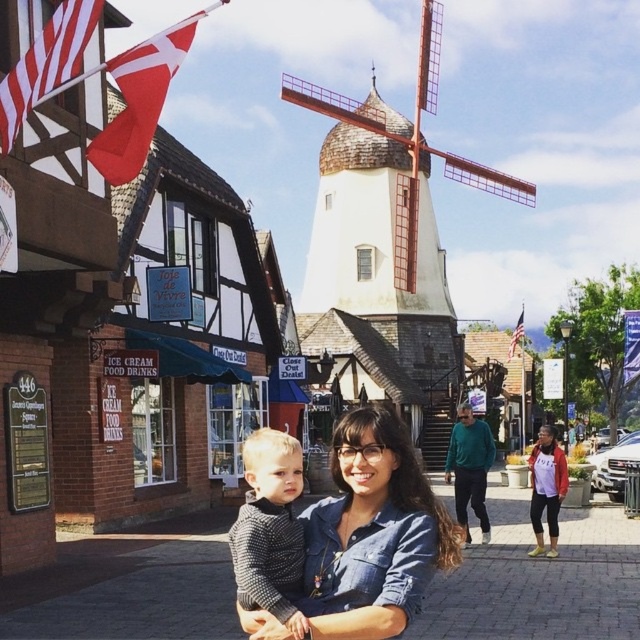
You are a photographer trying to capture the entire scene in one shot. Given that the denim shirt at center and the white matte windmill at center are both in your frame, which object would you need to zoom out to fully include?

The denim shirt at center occupies less space than the white matte windmill at center, so you would need to zoom out to include the larger white matte windmill at center in its entirety.

You are standing at the point labeled point (401,454) and want to walk to the point labeled point (337,116). Which direction should you move to get closer to your destination?

You should move to the left because point (401,454) is closer to the viewer than point (337,116), so moving left will take you towards the destination.

You are standing in the European town square and want to take a photo of both the windmill and the woman with the child. You notice two points marked on your map at coordinates point (339,609) and point (518,328). Which point should you stand at to ensure both the windmill in the background and the woman with the child in the foreground are clearly visible in your photo?

You should stand at point (339,609) because it is closer to the camera, allowing you to capture both the windmill in the background and the woman with the child in the foreground clearly.